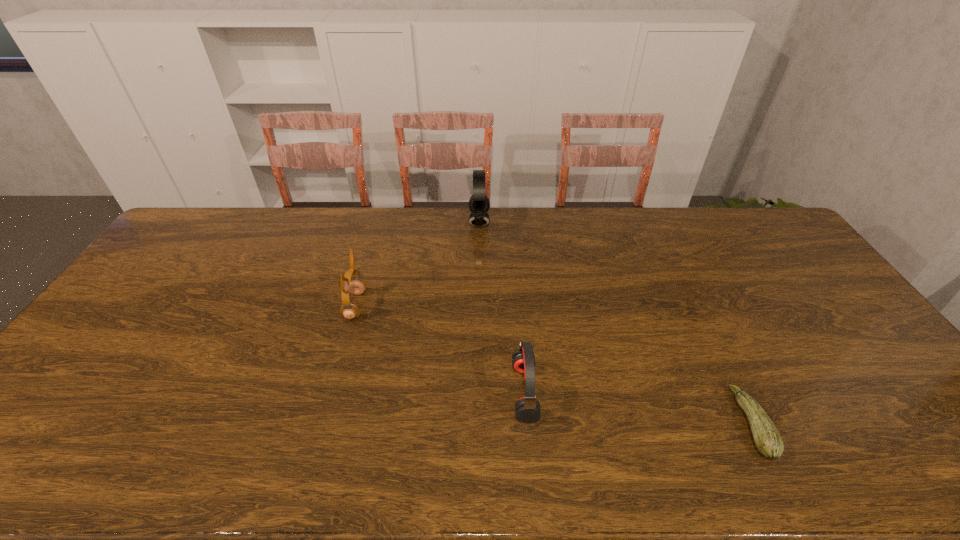
Identify the location of the second object from left to right. 479,204.

Where is `the second earphone from left to right`? The image size is (960, 540). the second earphone from left to right is located at coordinates (479, 204).

This screenshot has width=960, height=540. I want to click on the leftmost earphone, so click(x=350, y=311).

I want to click on the third nearest object, so click(x=350, y=311).

Where is `the nearest earphone`? the nearest earphone is located at coordinates (527, 408).

Where is `the second shortest object`? This screenshot has height=540, width=960. the second shortest object is located at coordinates (527, 408).

The height and width of the screenshot is (540, 960). I want to click on the shortest object, so click(768, 441).

You are a GUI agent. You are given a task and a screenshot of the screen. Output one action in this format:
    pyautogui.click(x=<x>, y=<y>)
    Task: Click on the rightmost object
    
    Given the screenshot: What is the action you would take?
    pyautogui.click(x=768, y=441)

Find the location of `free space located on the ear cups of the farthest object`. free space located on the ear cups of the farthest object is located at coordinates (567, 222).

This screenshot has width=960, height=540. Find the location of `vacant region located 0.270m on the front-facing side of the second nearest earphone`. vacant region located 0.270m on the front-facing side of the second nearest earphone is located at coordinates (453, 306).